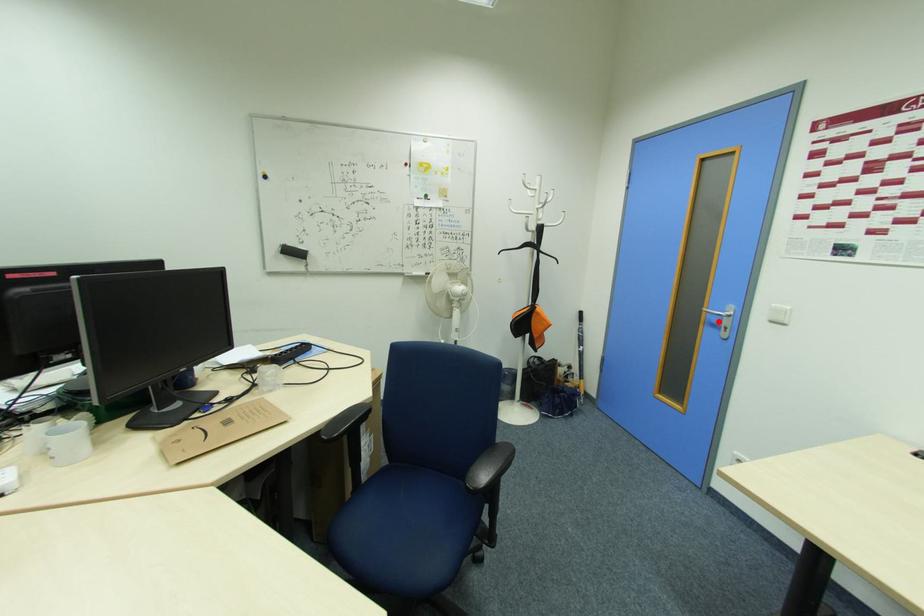
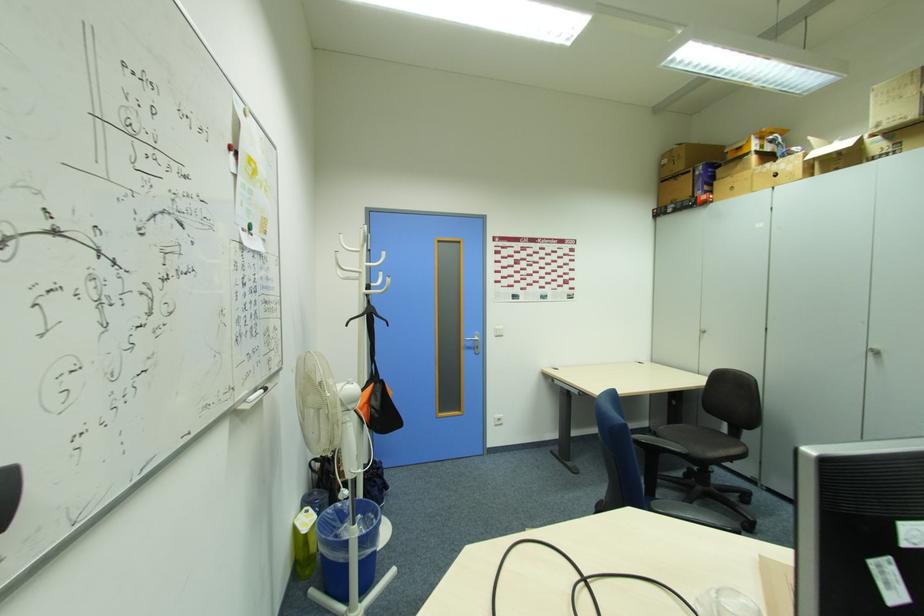
The point at the highlighted location is marked in the first image. Where is the corresponding point in the second image?

(472, 346)